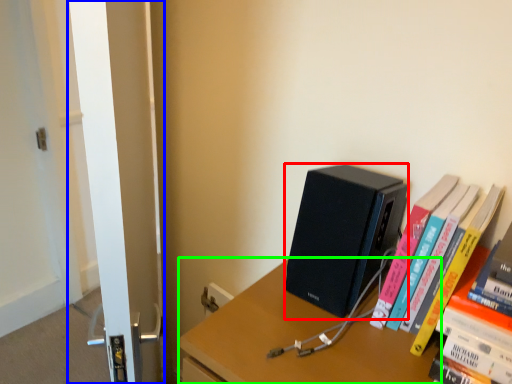
Question: Which object is positioned closest to computer (highlighted by a red box)? Select from screen door (highlighted by a blue box) and desk (highlighted by a green box).

Choices:
 (A) screen door
 (B) desk

Answer: (B)